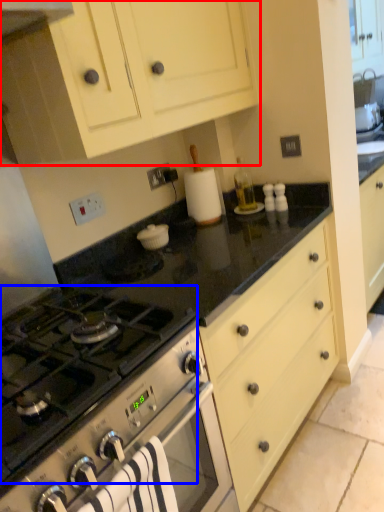
Question: Which object appears closest to the camera in this image, cabinetry (highlighted by a red box) or gas stove (highlighted by a blue box)?

Choices:
 (A) cabinetry
 (B) gas stove

Answer: (B)